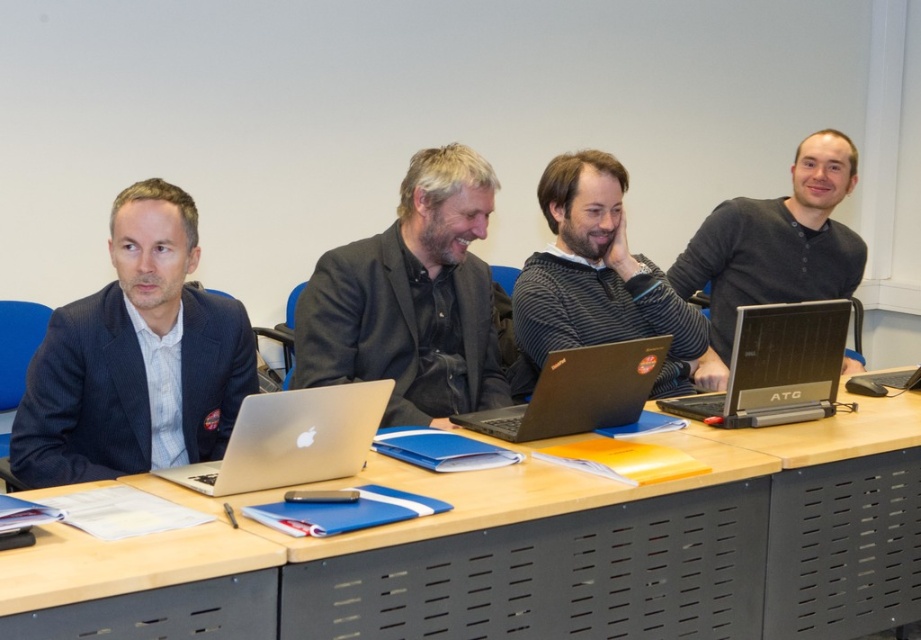
Is black matte sweater at right taller than black matte laptop at center?

Indeed, black matte sweater at right has a greater height compared to black matte laptop at center.

Who is more distant from viewer, (684, 266) or (511, 428)?

The point (684, 266) is behind.

The image size is (921, 640). Identify the location of black matte sweater at right. [773, 248].

Is wooden table at center smaller than striped sweater at center?

Incorrect, wooden table at center is not smaller in size than striped sweater at center.

Does wooden table at center come in front of striped sweater at center?

Yes, wooden table at center is in front of striped sweater at center.

Is point (666, 515) behind point (554, 230)?

No, it is in front of (554, 230).

Image resolution: width=921 pixels, height=640 pixels. In order to click on wooden table at center in this screenshot , I will do `click(532, 550)`.

Which is more to the left, dark gray suit at center or black matte sweater at right?

Positioned to the left is dark gray suit at center.

Is point (305, 372) positioned after point (813, 291)?

No, (305, 372) is closer to viewer.

Where is `dark gray suit at center`? The width and height of the screenshot is (921, 640). dark gray suit at center is located at coordinates (411, 300).